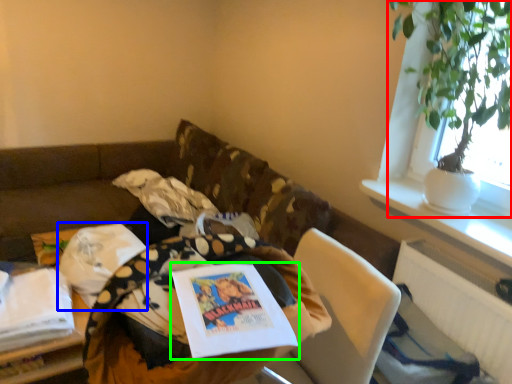
Question: Considering the real-world distances, which object is farthest from houseplant (highlighted by a red box)? material (highlighted by a blue box) or book (highlighted by a green box)?

Choices:
 (A) material
 (B) book

Answer: (A)